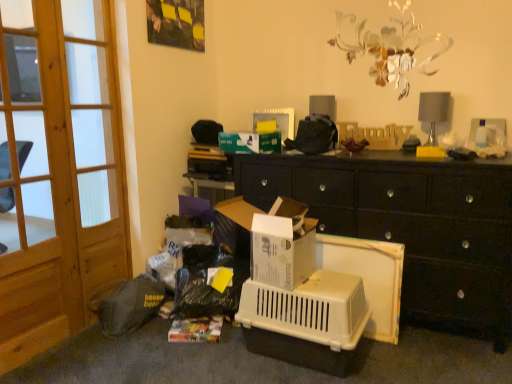
Describe the element at coordinates (127, 303) in the screenshot. I see `dark gray fabric bag at lower left` at that location.

What do you see at coordinates (411, 226) in the screenshot? I see `white plastic cabinet at center` at bounding box center [411, 226].

At what (x,y) coordinates should I click in order to perform the action: click on white cardboard box at center. Please return your answer as a coordinate pair (x, y). The image size is (512, 384). Looking at the image, I should click on (238, 211).

Where is `wooden screen door at left, the first screen door positioned from the right`? This screenshot has height=384, width=512. wooden screen door at left, the first screen door positioned from the right is located at coordinates (96, 141).

Image resolution: width=512 pixels, height=384 pixels. I want to click on dark gray fabric bag at lower left, so click(x=127, y=303).

Identify the location of cardboard box to the left of white plastic cabinet at center. [238, 211].

Is white cardboard box at center with white plastic cabinet at center?

No, white cardboard box at center is not in contact with white plastic cabinet at center.

In the scene shown: Is white cardboard box at center oriented away from white plastic cabinet at center?

Absolutely, white cardboard box at center is directed away from white plastic cabinet at center.

Locate an element on the screen. The image size is (512, 384). garbage beneath the white plastic cabinet at center (from a real-world perspective) is located at coordinates [x=127, y=303].

Does white plastic cabinet at center touch dark gray fabric bag at lower left?

No, white plastic cabinet at center is not in contact with dark gray fabric bag at lower left.

Can you tell me how much white plastic cabinet at center and dark gray fabric bag at lower left differ in facing direction?

17.2 degrees separate the facing orientations of white plastic cabinet at center and dark gray fabric bag at lower left.

From the image's perspective, is white plastic cabinet at center over dark gray fabric bag at lower left?

Yes, from the image's perspective, white plastic cabinet at center is over dark gray fabric bag at lower left.

From the image's perspective, is wooden screen door at left, which ranks as the 2th screen door in right-to-left order, below wooden screen door at left, the first screen door positioned from the right?

Yes, from the image's perspective, wooden screen door at left, which ranks as the 2th screen door in right-to-left order, is beneath wooden screen door at left, the first screen door positioned from the right.

From the picture: Is there a large distance between wooden screen door at left, which is the 1th screen door in left-to-right order, and wooden screen door at left, the first screen door positioned from the right?

wooden screen door at left, which is the 1th screen door in left-to-right order, is actually quite close to wooden screen door at left, the first screen door positioned from the right.

Can you confirm if wooden screen door at left, which ranks as the 2th screen door in right-to-left order, is wider than wooden screen door at left, the first screen door positioned from the right?

Indeed, wooden screen door at left, which ranks as the 2th screen door in right-to-left order, has a greater width compared to wooden screen door at left, the first screen door positioned from the right.

How different are the orientations of wooden screen door at left, which is the 1th screen door in left-to-right order, and dark gray fabric bag at lower left in degrees?

wooden screen door at left, which is the 1th screen door in left-to-right order, and dark gray fabric bag at lower left are facing 107 degrees away from each other.

Who is smaller, wooden screen door at left, which ranks as the 2th screen door in right-to-left order, or dark gray fabric bag at lower left?

With smaller size is dark gray fabric bag at lower left.

Considering the positions of objects wooden screen door at left, which ranks as the 2th screen door in right-to-left order, and dark gray fabric bag at lower left in the image provided, who is more to the right, wooden screen door at left, which ranks as the 2th screen door in right-to-left order, or dark gray fabric bag at lower left?

From the viewer's perspective, dark gray fabric bag at lower left appears more on the right side.

Is wooden screen door at left, which ranks as the 2th screen door in right-to-left order, taller than dark gray fabric bag at lower left?

Indeed, wooden screen door at left, which ranks as the 2th screen door in right-to-left order, has a greater height compared to dark gray fabric bag at lower left.

From the image's perspective, is wooden screen door at left, which is the 1th screen door in left-to-right order, above or below white plastic cabinet at center?

Based on their image positions, wooden screen door at left, which is the 1th screen door in left-to-right order, is located above white plastic cabinet at center.

Does wooden screen door at left, which ranks as the 2th screen door in right-to-left order, have a smaller size compared to white plastic cabinet at center?

Indeed, wooden screen door at left, which ranks as the 2th screen door in right-to-left order, has a smaller size compared to white plastic cabinet at center.

Between wooden screen door at left, which is the 1th screen door in left-to-right order, and white plastic cabinet at center, which one appears on the left side from the viewer's perspective?

Positioned to the left is wooden screen door at left, which is the 1th screen door in left-to-right order.

From the image's perspective, which is above, dark gray fabric bag at lower left or wooden screen door at left, the first screen door positioned from the right?

wooden screen door at left, the first screen door positioned from the right, is shown above in the image.

Could you tell me if dark gray fabric bag at lower left is turned towards wooden screen door at left, the first screen door positioned from the right?

No, dark gray fabric bag at lower left does not turn towards wooden screen door at left, the first screen door positioned from the right.

Does dark gray fabric bag at lower left have a greater width compared to wooden screen door at left, which is counted as the second screen door, starting from the left?

Correct, the width of dark gray fabric bag at lower left exceeds that of wooden screen door at left, which is counted as the second screen door, starting from the left.

From the dark gray fabric bag at lower left, count the 1st screen door to the left and point to it. Please provide its 2D coordinates.

[(96, 141)]

Considering the points (3, 71) and (228, 215), which point is behind, point (3, 71) or point (228, 215)?

The point (228, 215) is behind.

What's the angular difference between wooden screen door at left, which ranks as the 2th screen door in right-to-left order, and white cardboard box at center's facing directions?

The angular difference between wooden screen door at left, which ranks as the 2th screen door in right-to-left order, and white cardboard box at center is 88.7 degrees.

Does wooden screen door at left, which ranks as the 2th screen door in right-to-left order, touch white cardboard box at center?

No.

From the image's perspective, is wooden screen door at left, which is the 1th screen door in left-to-right order, positioned above or below white cardboard box at center?

wooden screen door at left, which is the 1th screen door in left-to-right order, is above white cardboard box at center.

Where is `cardboard box that appears behind the white plastic cabinet at center`? This screenshot has width=512, height=384. cardboard box that appears behind the white plastic cabinet at center is located at coordinates (238, 211).

Locate an element on the screen. This screenshot has width=512, height=384. cabinetry that is above the dark gray fabric bag at lower left (from the image's perspective) is located at coordinates (411, 226).

Based on their spatial positions, is white plastic cabinet at center or wooden screen door at left, which is the 1th screen door in left-to-right order, further from white cardboard box at center?

The object further to white cardboard box at center is wooden screen door at left, which is the 1th screen door in left-to-right order.

When comparing their distances from white plastic cabinet at center, does dark gray fabric bag at lower left or white cardboard box at center seem further?

Among the two, dark gray fabric bag at lower left is located further to white plastic cabinet at center.

Considering their positions, is wooden screen door at left, which ranks as the 2th screen door in right-to-left order, positioned closer to dark gray fabric bag at lower left than white cardboard box at center?

wooden screen door at left, which ranks as the 2th screen door in right-to-left order, is closer to dark gray fabric bag at lower left.

Consider the image. Estimate the real-world distances between objects in this image. Which object is further from dark gray fabric bag at lower left, wooden screen door at left, which is counted as the second screen door, starting from the left, or wooden screen door at left, which ranks as the 2th screen door in right-to-left order?

wooden screen door at left, which is counted as the second screen door, starting from the left, is further to dark gray fabric bag at lower left.

Which object lies nearer to the anchor point wooden screen door at left, the first screen door positioned from the right, white plastic cabinet at center or white cardboard box at center?

white cardboard box at center is closer to wooden screen door at left, the first screen door positioned from the right.

Which object lies nearer to the anchor point white cardboard box at center, wooden screen door at left, which is counted as the second screen door, starting from the left, or dark gray fabric bag at lower left?

The object closer to white cardboard box at center is dark gray fabric bag at lower left.

When comparing their distances from white plastic cabinet at center, does dark gray fabric bag at lower left or wooden screen door at left, the first screen door positioned from the right, seem further?

The object further to white plastic cabinet at center is wooden screen door at left, the first screen door positioned from the right.

Looking at the image, which one is located closer to white cardboard box at center, wooden screen door at left, which is counted as the second screen door, starting from the left, or wooden screen door at left, which is the 1th screen door in left-to-right order?

wooden screen door at left, which is the 1th screen door in left-to-right order, is closer to white cardboard box at center.

Identify the location of screen door between wooden screen door at left, which is counted as the second screen door, starting from the left, and dark gray fabric bag at lower left in the up-down direction. The width and height of the screenshot is (512, 384). (58, 170).

Image resolution: width=512 pixels, height=384 pixels. I want to click on garbage between wooden screen door at left, which is counted as the second screen door, starting from the left, and white cardboard box at center, so click(127, 303).

The width and height of the screenshot is (512, 384). I want to click on cardboard box between wooden screen door at left, which ranks as the 2th screen door in right-to-left order, and white plastic cabinet at center, in the horizontal direction, so click(238, 211).

You are a GUI agent. You are given a task and a screenshot of the screen. Output one action in this format:
    pyautogui.click(x=<x>, y=<y>)
    Task: Click on the garbage situated between wooden screen door at left, which is the 1th screen door in left-to-right order, and white cardboard box at center from left to right
    
    Given the screenshot: What is the action you would take?
    pyautogui.click(x=127, y=303)